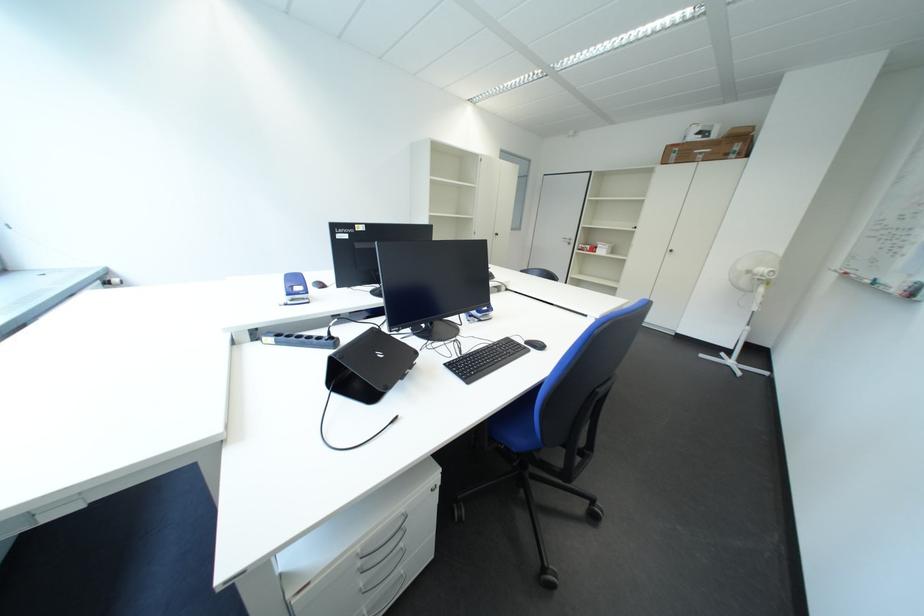
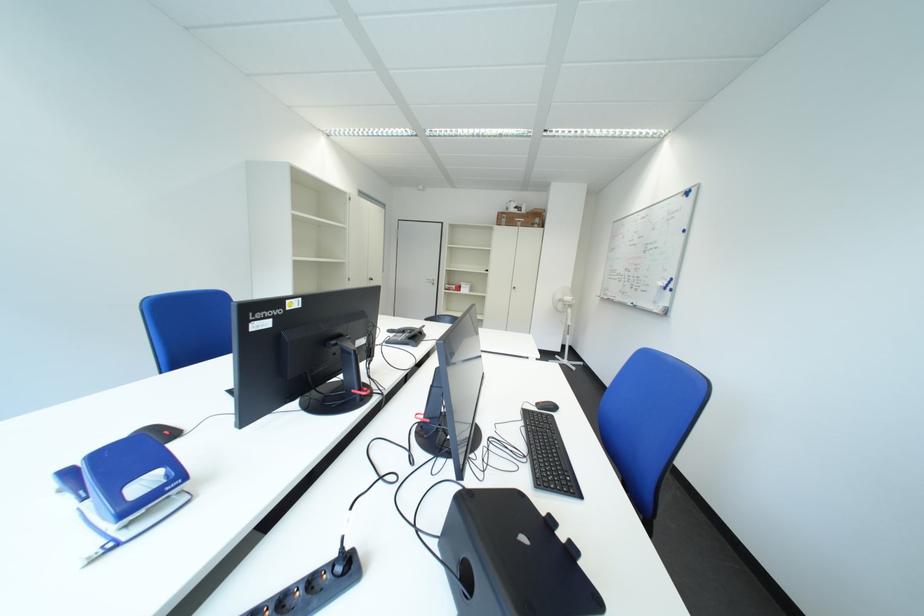
The point at (x=686, y=158) is marked in the first image. Where is the corresponding point in the second image?

(517, 223)